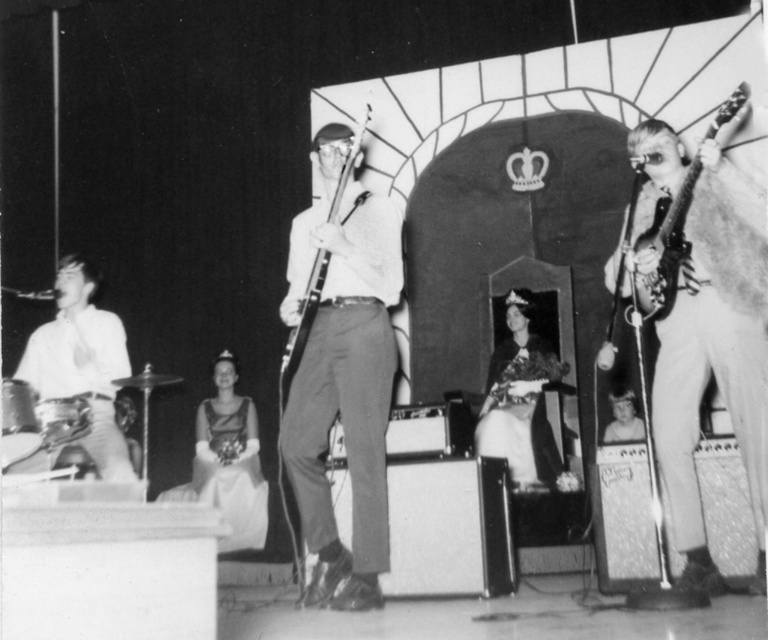
You are a photographer positioned at the back of the stage. You want to capture a closeup shot of the metallic silver electric guitar at right and the metallic silver bass at center. Which instrument will appear larger in your photo?

The metallic silver electric guitar at right appears larger in the photo because it is closer to the viewer than the metallic silver bass at center.

You are a photographer standing at the back of the stage. You want to take a photo that includes both point (114,449) and point (664,292). Which point is closer to your camera?

Point (114,449) is closer to the camera than point (664,292).

You are sitting in the front row of the audience, 20 feet away from the stage. You want to toss a small note to the musician wearing the smooth white shirt at left. Can you reach them by throwing the note?

The smooth white shirt at left is 11.97 feet away from the viewer, so yes, you can reach them by throwing the note as the distance is less than 20 feet.